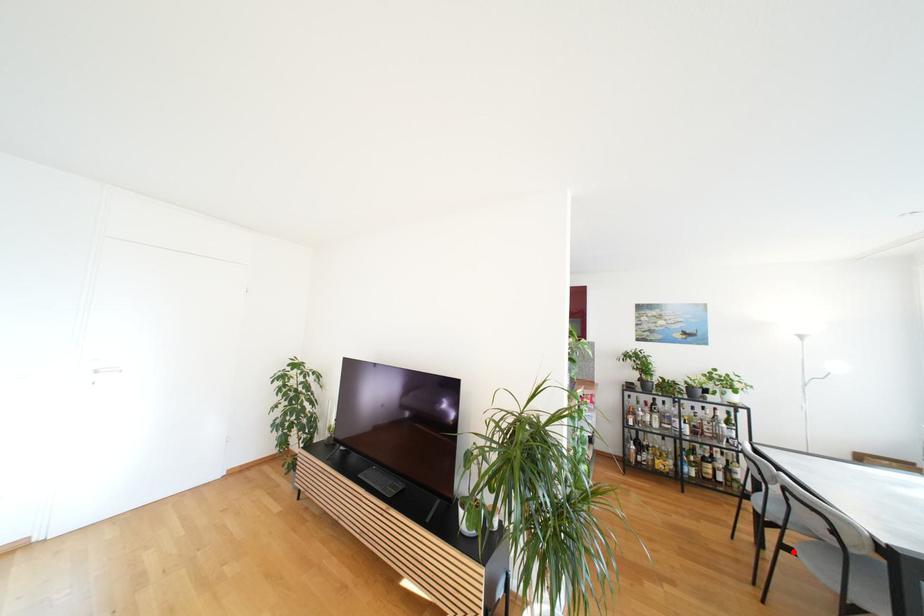
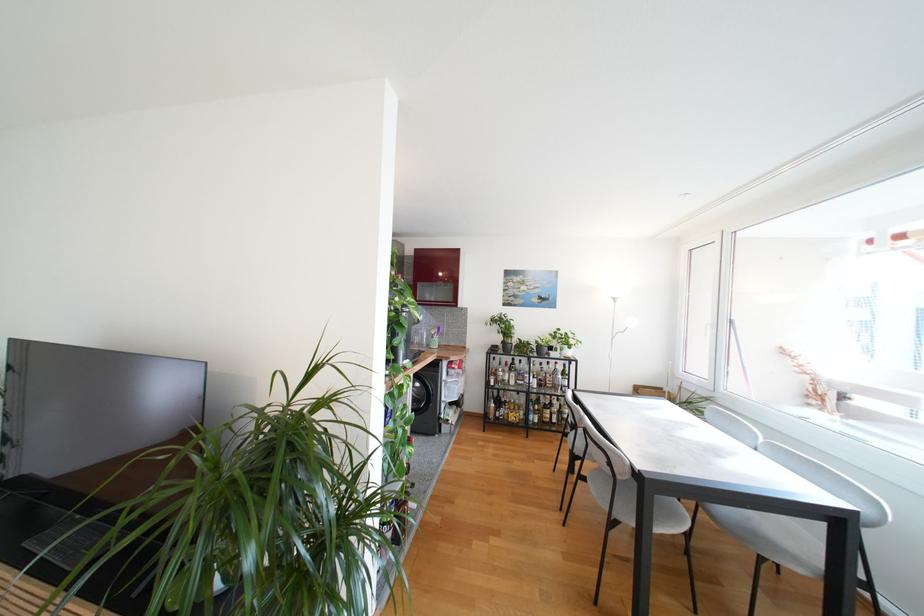
Question: I am providing you with two images of the same scene from different viewpoints. A red point is marked on the first image. Can you still see the location of the red point in image 2?

Choices:
 (A) Yes
 (B) No

Answer: (A)